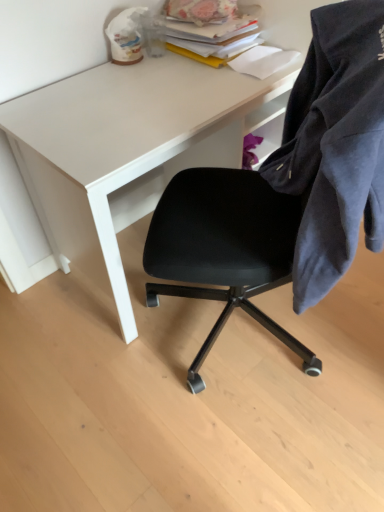
Identify the location of free space in front of stacked paper at upper right. (193, 81).